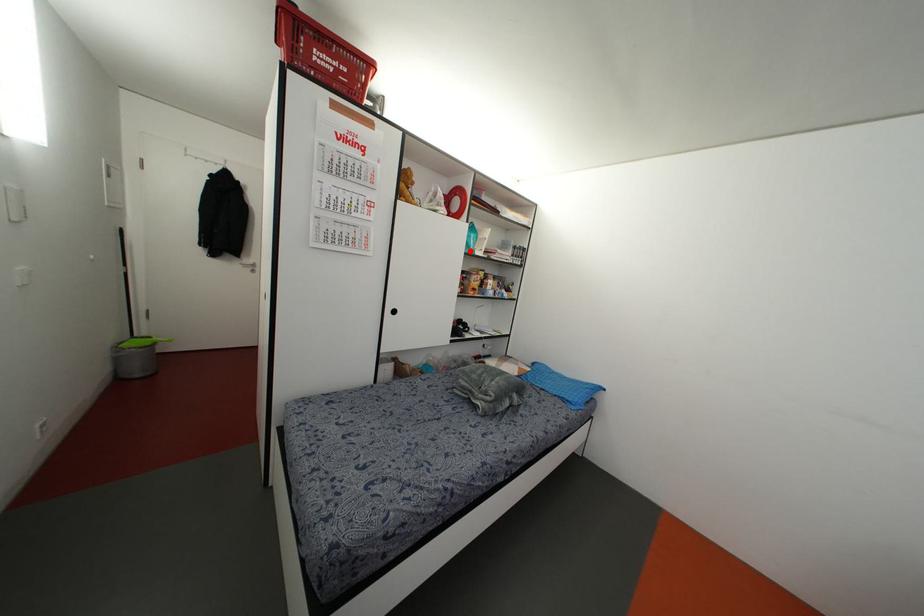
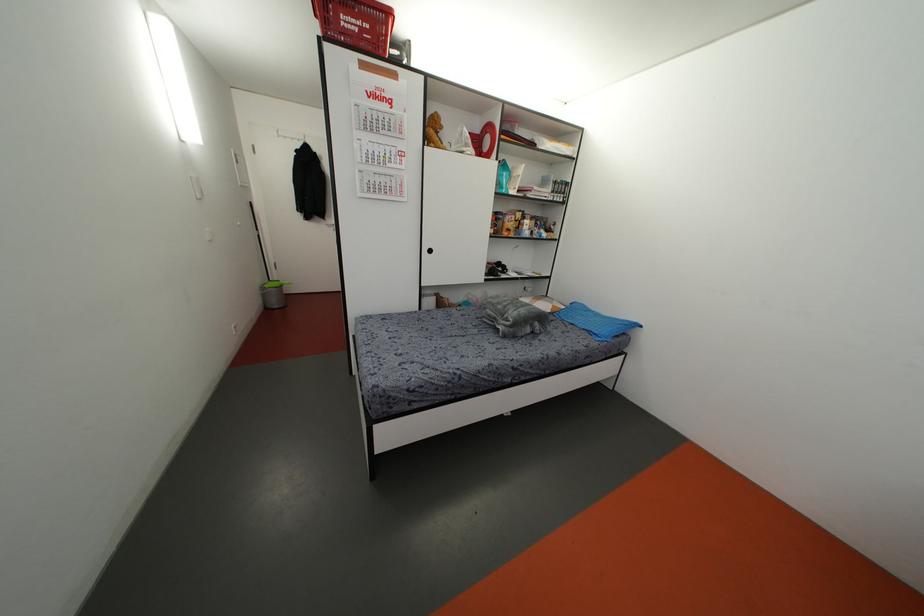
In the second image, find the point that corresponds to the highlighted location in the first image.

(503, 191)